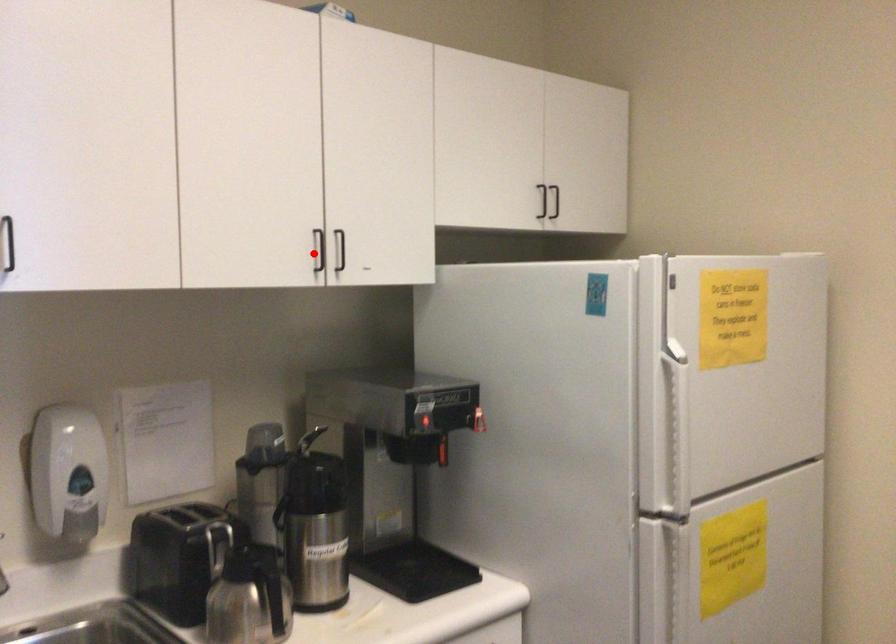
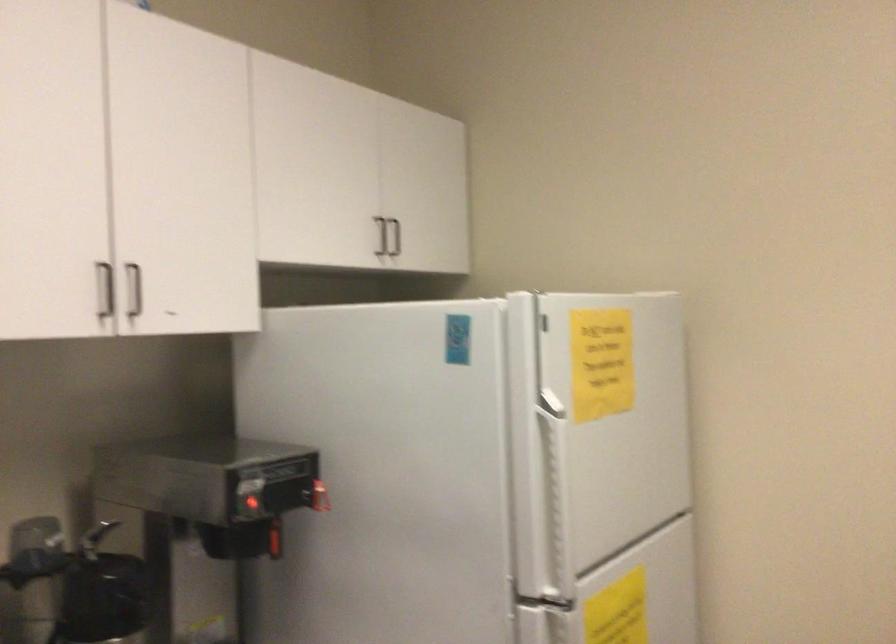
Question: I am providing you with two images of the same scene from different viewpoints. Image1 has a red point marked. In image2, the corresponding 3D location appears at what relative position? Reply with the corresponding letter.

Choices:
 (A) Closer
 (B) Farther

Answer: (A)